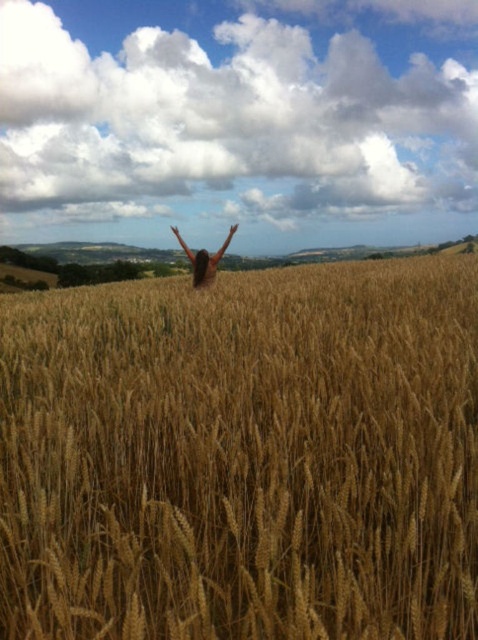
Who is positioned more to the right, golden wheat field at center or brown hair at center?

Positioned to the right is golden wheat field at center.

Which is more to the left, golden wheat field at center or brown hair at center?

Positioned to the left is brown hair at center.

Is point (420, 308) positioned in front of point (187, 252)?

Yes.

In order to click on golden wheat field at center in this screenshot , I will do click(x=242, y=456).